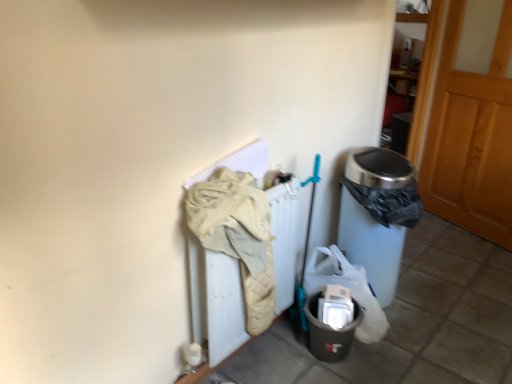
Question: Which is correct: beige quilted blanket at center-left is inside matte gray plastic bin at lower right, or outside of it?

Choices:
 (A) outside
 (B) inside

Answer: (A)

Question: From a real-world perspective, relative to matte gray plastic bin at lower right, is beige quilted blanket at center-left vertically above or below?

Choices:
 (A) above
 (B) below

Answer: (A)

Question: Estimate the real-world distances between objects in this image. Which object is closer to the matte gray plastic bin at lower right?

Choices:
 (A) wooden at right
 (B) beige quilted blanket at center-left

Answer: (B)

Question: Which of these objects is positioned closest to the wooden at right?

Choices:
 (A) matte gray plastic bin at lower right
 (B) beige quilted blanket at center-left

Answer: (A)